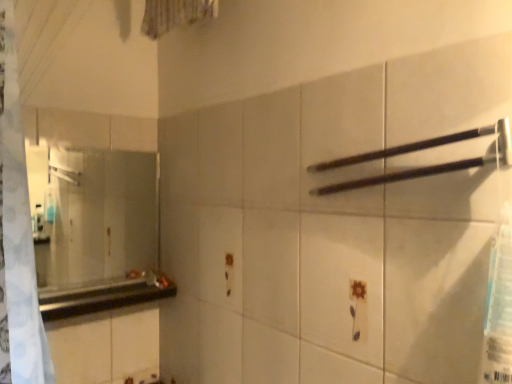
Question: Could you tell me if black matte towel bar at upper right is turned towards clear glass mirror at left?

Choices:
 (A) yes
 (B) no

Answer: (B)

Question: Is black matte towel bar at upper right not close to clear glass mirror at left?

Choices:
 (A) yes
 (B) no

Answer: (A)

Question: Is the depth of black matte towel bar at upper right greater than that of clear glass mirror at left?

Choices:
 (A) yes
 (B) no

Answer: (B)

Question: Considering the relative sizes of black matte towel bar at upper right and clear glass mirror at left in the image provided, is black matte towel bar at upper right smaller than clear glass mirror at left?

Choices:
 (A) no
 (B) yes

Answer: (B)

Question: Is black matte towel bar at upper right at the right side of clear glass mirror at left?

Choices:
 (A) yes
 (B) no

Answer: (A)

Question: Considering the relative sizes of black matte towel bar at upper right and clear glass mirror at left in the image provided, is black matte towel bar at upper right taller than clear glass mirror at left?

Choices:
 (A) no
 (B) yes

Answer: (A)

Question: Is black glossy counter top at left positioned before black matte towel bar at upper right?

Choices:
 (A) no
 (B) yes

Answer: (A)

Question: Does black glossy counter top at left have a lesser width compared to black matte towel bar at upper right?

Choices:
 (A) yes
 (B) no

Answer: (B)

Question: Is black glossy counter top at left oriented towards black matte towel bar at upper right?

Choices:
 (A) no
 (B) yes

Answer: (A)

Question: Can you confirm if black glossy counter top at left is smaller than black matte towel bar at upper right?

Choices:
 (A) yes
 (B) no

Answer: (B)

Question: Is black glossy counter top at left to the right of black matte towel bar at upper right from the viewer's perspective?

Choices:
 (A) yes
 (B) no

Answer: (B)

Question: Can you see black glossy counter top at left touching black matte towel bar at upper right?

Choices:
 (A) no
 (B) yes

Answer: (A)

Question: Is clear glass mirror at left turned away from black matte towel bar at upper right?

Choices:
 (A) yes
 (B) no

Answer: (B)